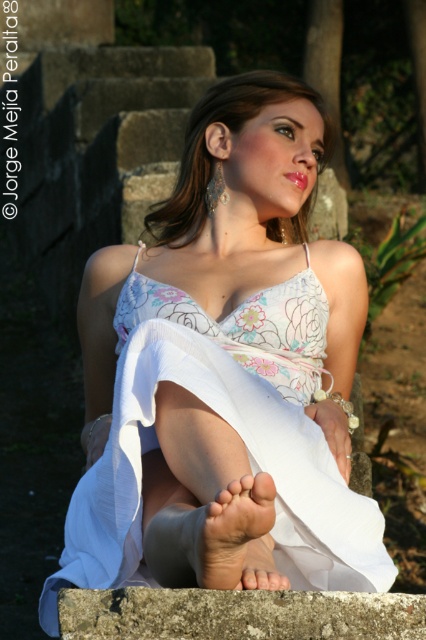
Question: Can you confirm if dry skin foot at lower center is positioned to the right of glossy pink lipstick at center?

Choices:
 (A) no
 (B) yes

Answer: (A)

Question: Which point is farther to the camera?

Choices:
 (A) (226, 209)
 (B) (296, 172)

Answer: (A)

Question: Observing the image, what is the correct spatial positioning of dry skin foot at lower center in reference to glossy pink lipstick at center?

Choices:
 (A) right
 (B) left

Answer: (B)

Question: Which object is positioned farthest from the glossy pink lipstick at center?

Choices:
 (A) white sheer dress at center
 (B) gray rough concrete at lower center

Answer: (B)

Question: Is white sheer dress at center closer to camera compared to glossy pink lipstick at center?

Choices:
 (A) no
 (B) yes

Answer: (B)

Question: Which object is positioned closest to the dry skin foot at lower center?

Choices:
 (A) glossy pink lipstick at center
 (B) white sheer dress at center

Answer: (B)